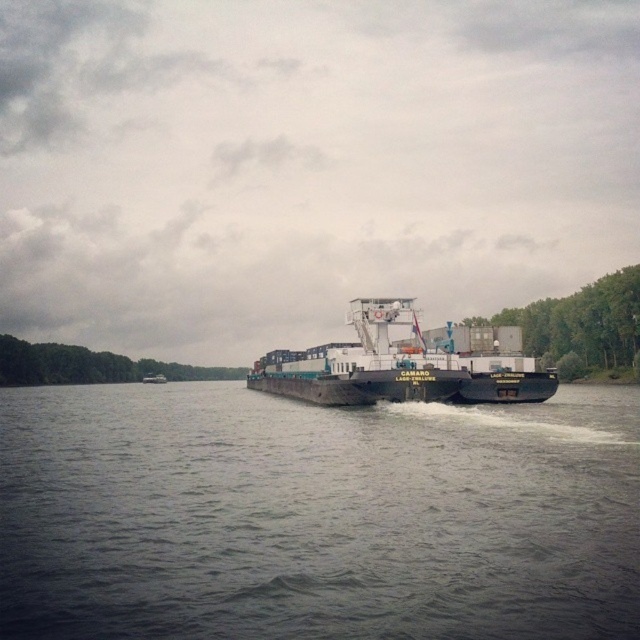
In the scene shown: You are standing on the deck of the cargo ship and looking down. Where is the gray concrete river at center located?

The gray concrete river at center is located at point (x=316, y=516).

You are a drone operator tasked with capturing aerial footage of the gray concrete river at center and the white matte cargo ship at center. Your drone has a limited battery and can only focus on one object at a time. Based on their sizes, which object should you prioritize filming first to ensure it fits entirely within the camera frame?

The gray concrete river at center is shorter than the white matte cargo ship at center, so you should prioritize filming the gray concrete river at center first since it is smaller and will require less space in the camera frame.